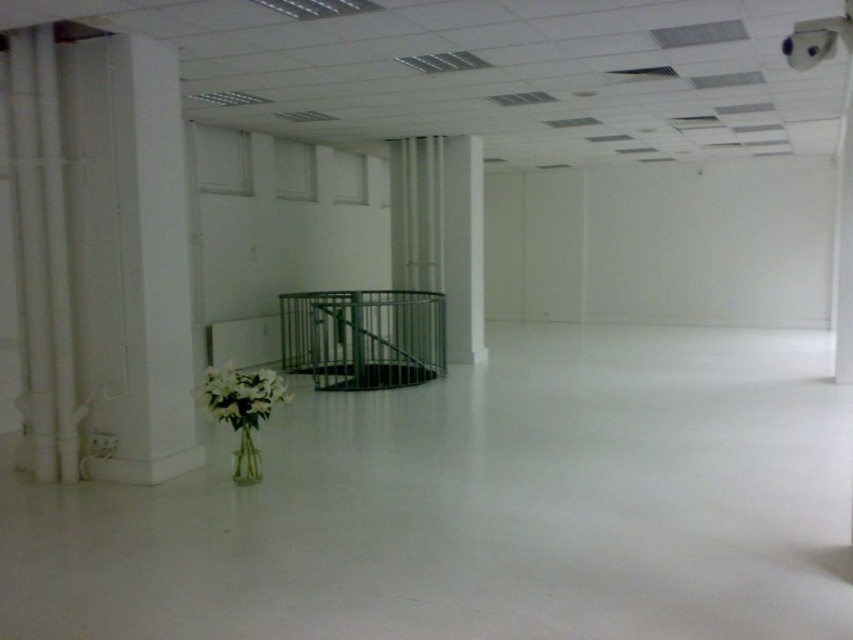
Does point (173, 51) lie in front of point (202, 404)?

That is False.

Does point (59, 58) lie behind point (223, 410)?

Yes, it is.

I want to click on white smooth pillar at left, so click(129, 253).

Is green metal balustrade at center below white matte flowers at lower left?

Actually, green metal balustrade at center is above white matte flowers at lower left.

Describe the element at coordinates (363, 337) in the screenshot. I see `green metal balustrade at center` at that location.

The width and height of the screenshot is (853, 640). I want to click on green metal balustrade at center, so 363,337.

Between point (82, 316) and point (335, 349), which one is positioned behind?

The point (335, 349) is more distant.

The height and width of the screenshot is (640, 853). What do you see at coordinates (129, 253) in the screenshot?
I see `white smooth pillar at left` at bounding box center [129, 253].

The width and height of the screenshot is (853, 640). Identify the location of white smooth pillar at left. (129, 253).